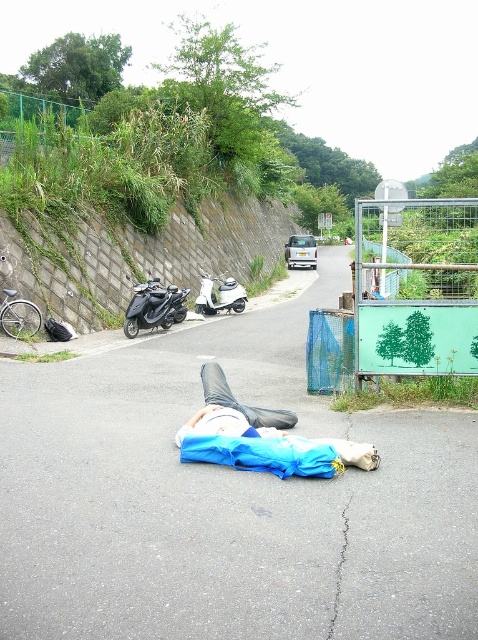
You are a pedestrian walking along the road in the scene. You see a point marked at coordinates (260, 436) which indicates a blue fabric at center. Is the blue fabric at center closer to the stone retaining wall or the metal fence?

The blue fabric at center is closer to the stone retaining wall because the point coordinates (260, 436) place it near the retaining wall side of the road.

You are standing on the road in the scene and want to place a small marker at each of the two points labeled point [183,429] and point [229,276]. Which point should you place the marker closer to your current position?

Point [183,429] is closer to the camera than point [229,276], so you should place the marker closer to point [183,429] since it is nearer to your current position.